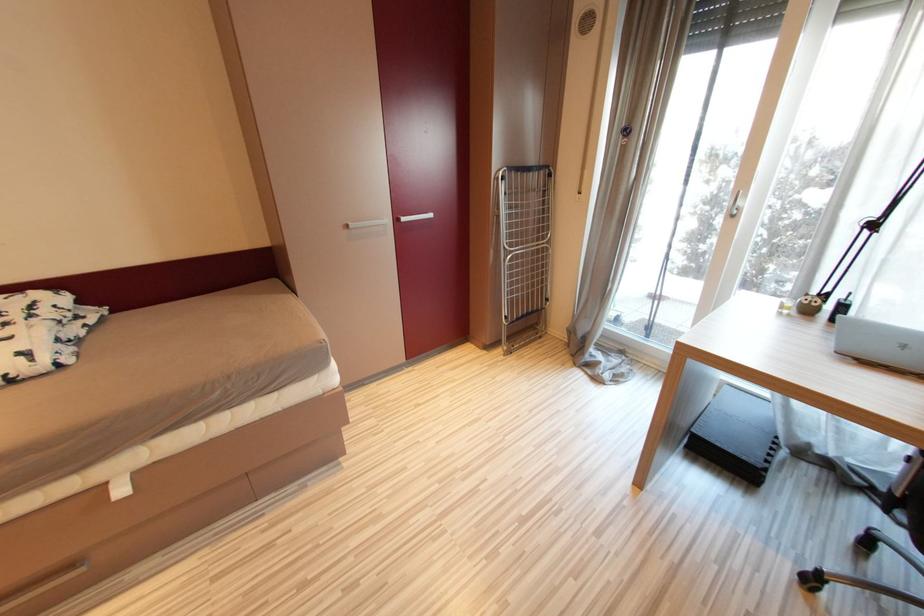
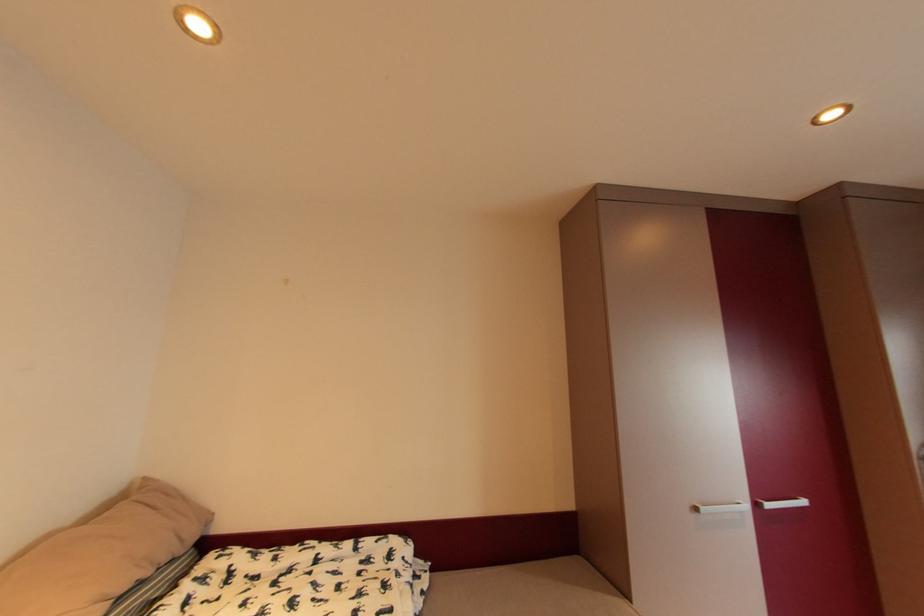
Based on the photo, the first image is from the beginning of the video and the second image is from the end. How did the camera likely rotate when shooting the video?

The camera's rotation is toward left-up.